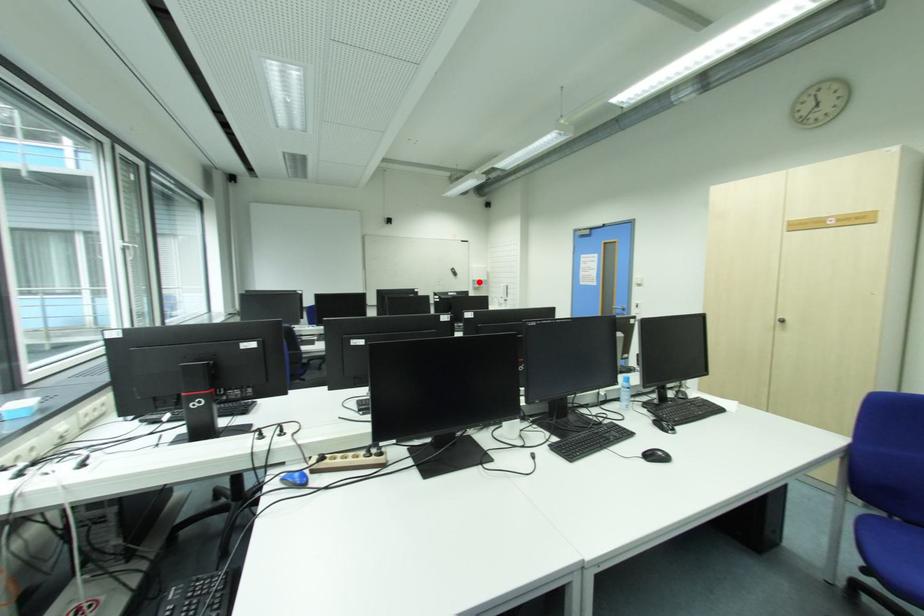
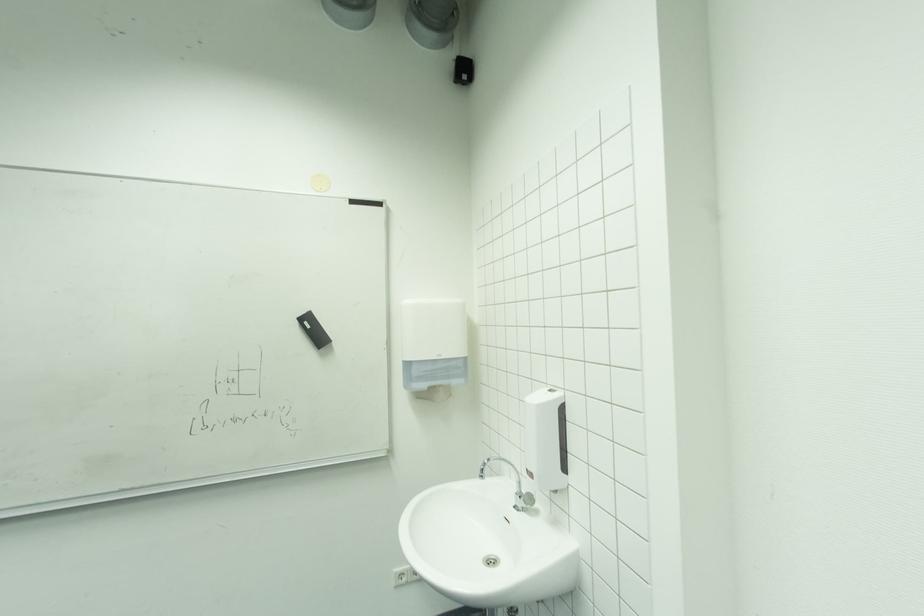
Question: I am providing you with two images of the same scene from different viewpoints. Given a red point in image1, look at the same physical point in image2. Is it:

Choices:
 (A) Closer to the viewpoint
 (B) Farther from the viewpoint

Answer: (B)